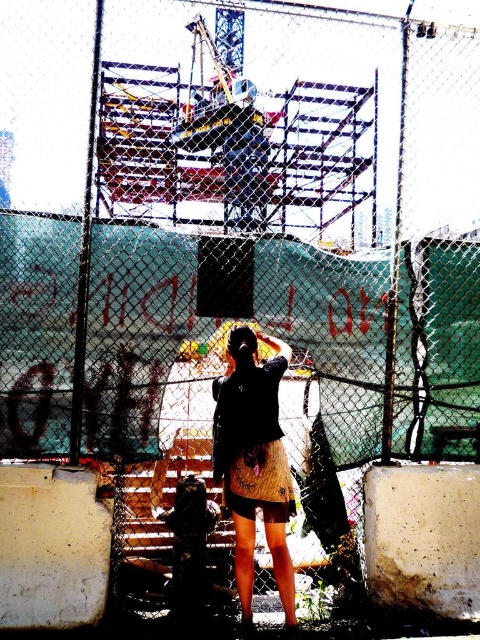
Does matte black shirt at center appear on the left side of wooden skirt at center?

Incorrect, matte black shirt at center is not on the left side of wooden skirt at center.

Is point (245, 548) positioned behind point (249, 502)?

That is False.

Where is `matte black shirt at center`? The image size is (480, 640). matte black shirt at center is located at coordinates (253, 461).